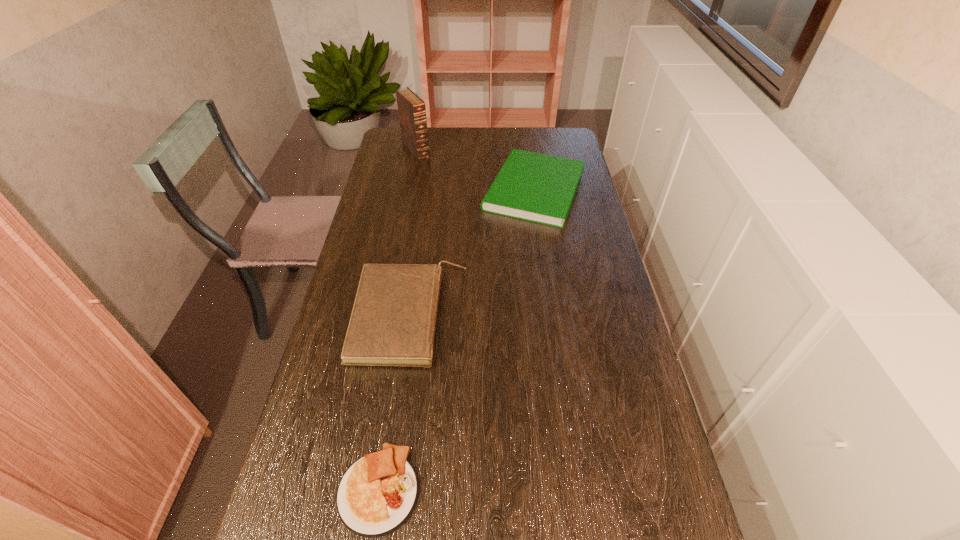
Locate an element on the screen. free region located 0.400m on the back of the omelet is located at coordinates (406, 307).

This screenshot has height=540, width=960. Find the location of `object that is at the far edge`. object that is at the far edge is located at coordinates (412, 113).

Find the location of a particular element. Bible present at the left edge is located at coordinates (412, 113).

Find the location of a particular element. This screenshot has width=960, height=540. paperback book that is at the left edge is located at coordinates (393, 320).

This screenshot has width=960, height=540. Find the location of `omelet at the left edge`. omelet at the left edge is located at coordinates (377, 494).

You are a GUI agent. You are given a task and a screenshot of the screen. Output one action in this format:
    pyautogui.click(x=<x>, y=<y>)
    Task: Click on the object present at the right edge
    
    Given the screenshot: What is the action you would take?
    pyautogui.click(x=540, y=188)

This screenshot has width=960, height=540. I want to click on object that is at the far left corner, so click(412, 113).

What are the coordinates of `vacant space at the left edge` in the screenshot? It's located at (312, 409).

Identify the location of vacant space at the right edge. (571, 227).

The image size is (960, 540). Find the location of `vacant space at the far left corner`. vacant space at the far left corner is located at coordinates (399, 140).